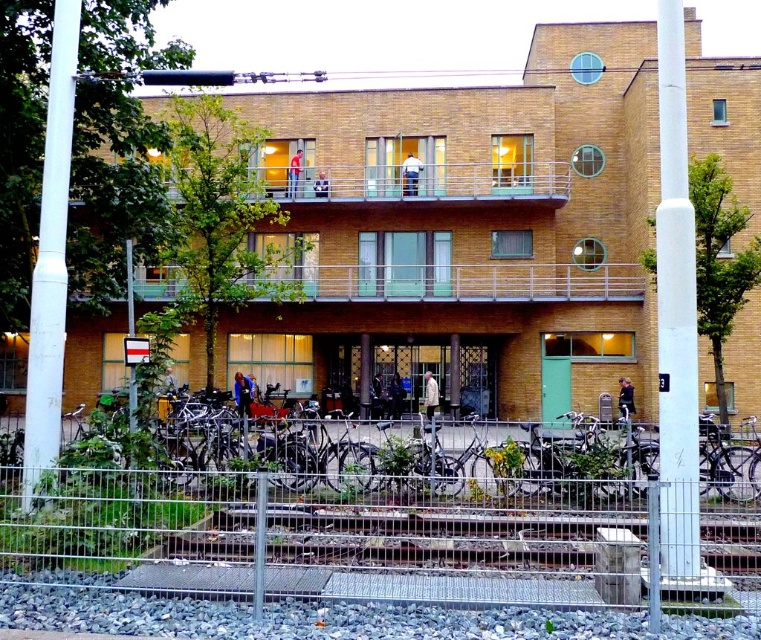
You are a visitor approaching the building and notice the white smooth pole at left and the brown wooden balcony at upper center. Which structure is taller from your perspective?

The white smooth pole at left is taller than the brown wooden balcony at upper center.